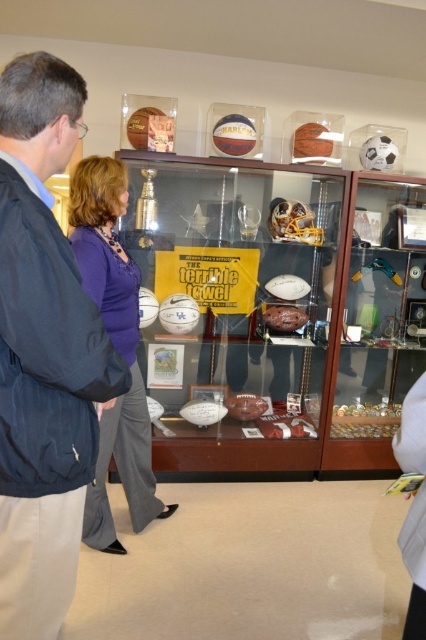
Question: Is dark blue jacket at left to the left of purple fabric blouse at center from the viewer's perspective?

Choices:
 (A) no
 (B) yes

Answer: (A)

Question: Which point is closer to the camera?

Choices:
 (A) (86, 273)
 (B) (48, 372)

Answer: (B)

Question: Is dark blue jacket at left positioned before purple fabric blouse at center?

Choices:
 (A) no
 (B) yes

Answer: (B)

Question: Which object is closer to the camera taking this photo?

Choices:
 (A) purple fabric blouse at center
 (B) dark blue jacket at left

Answer: (B)

Question: Considering the relative positions of dark blue jacket at left and purple fabric blouse at center in the image provided, where is dark blue jacket at left located with respect to purple fabric blouse at center?

Choices:
 (A) above
 (B) below

Answer: (A)